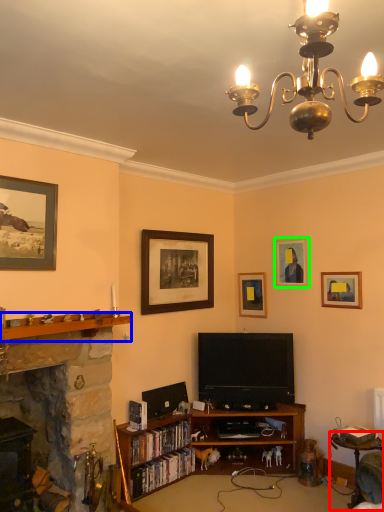
Question: Which is farther away from table (highlighted by a red box)? shelf (highlighted by a blue box) or picture frame (highlighted by a green box)?

Choices:
 (A) shelf
 (B) picture frame

Answer: (A)